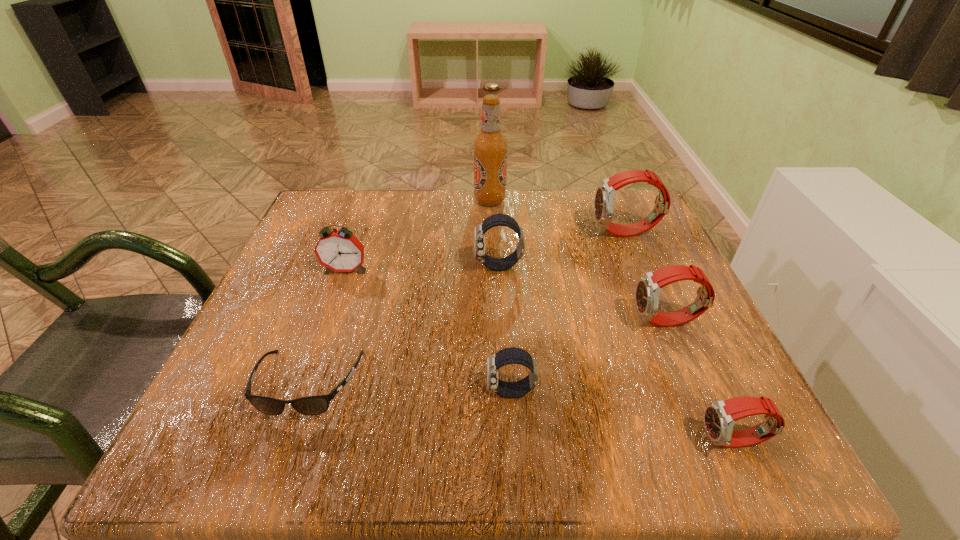
Where is `the farthest object`? the farthest object is located at coordinates (490, 146).

The height and width of the screenshot is (540, 960). I want to click on the tallest object, so click(490, 146).

Locate an element on the screen. the seventh nearest object is located at coordinates (605, 194).

This screenshot has width=960, height=540. I want to click on the tallest watch, so click(605, 194).

Identify the location of the farther dark watch. This screenshot has height=540, width=960. (501, 264).

You are a GUI agent. You are given a task and a screenshot of the screen. Output one action in this format:
    pyautogui.click(x=<x>, y=<y>)
    Task: Click on the bigger dark watch
    The image size is (960, 540).
    Given the screenshot: What is the action you would take?
    pyautogui.click(x=501, y=264)

Locate an element on the screen. This screenshot has height=540, width=960. the second biggest red watch is located at coordinates (648, 288).

The width and height of the screenshot is (960, 540). Identify the location of the second nearest red watch. [x=648, y=288].

Locate an element on the screen. The height and width of the screenshot is (540, 960). alarm clock is located at coordinates (339, 250).

Locate an element on the screen. The width and height of the screenshot is (960, 540). the fourth farthest watch is located at coordinates (512, 355).